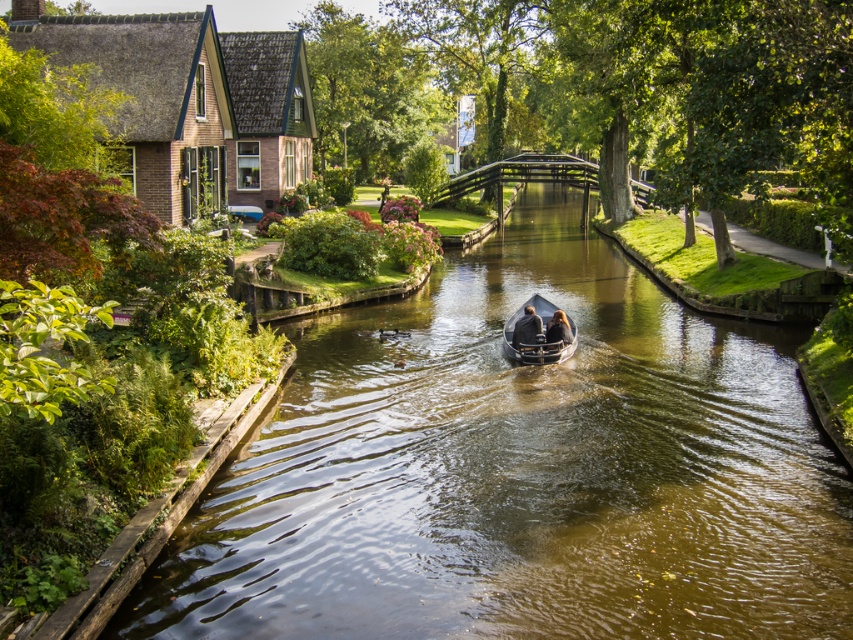
Can you confirm if green smooth water at center is positioned below metallic gray boat at center?

Yes, green smooth water at center is below metallic gray boat at center.

Is green smooth water at center positioned behind metallic gray boat at center?

No, green smooth water at center is closer to the viewer.

Between point (573, 404) and point (525, 342), which one is positioned in front?

Point (573, 404) is more forward.

Identify the location of green smooth water at center. (519, 472).

Locate an element on the screen. The height and width of the screenshot is (640, 853). metallic gray boat at center is located at coordinates (537, 337).

Between metallic gray boat at center and smooth black boat at center, which one is positioned higher?

Positioned higher is smooth black boat at center.

Describe the element at coordinates (537, 337) in the screenshot. This screenshot has width=853, height=640. I see `metallic gray boat at center` at that location.

Image resolution: width=853 pixels, height=640 pixels. I want to click on metallic gray boat at center, so click(537, 337).

Is smooth black boat at center further to camera compared to smooth brown hair at center?

That is False.

Does point (515, 323) come farther from viewer compared to point (548, 321)?

No, it is not.

What are the coordinates of `smooth black boat at center` in the screenshot? It's located at (526, 326).